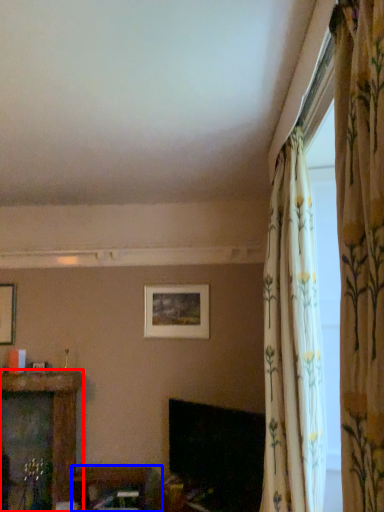
Question: Which object appears closest to the camera in this image, furniture (highlighted by a red box) or furniture (highlighted by a blue box)?

Choices:
 (A) furniture
 (B) furniture

Answer: (B)